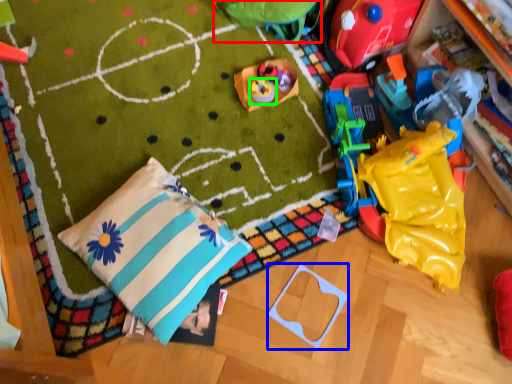
Question: Estimate the real-world distances between objects in this image. Which object is closer to toy (highlighted by a red box), toy (highlighted by a blue box) or toy (highlighted by a green box)?

Choices:
 (A) toy
 (B) toy

Answer: (B)